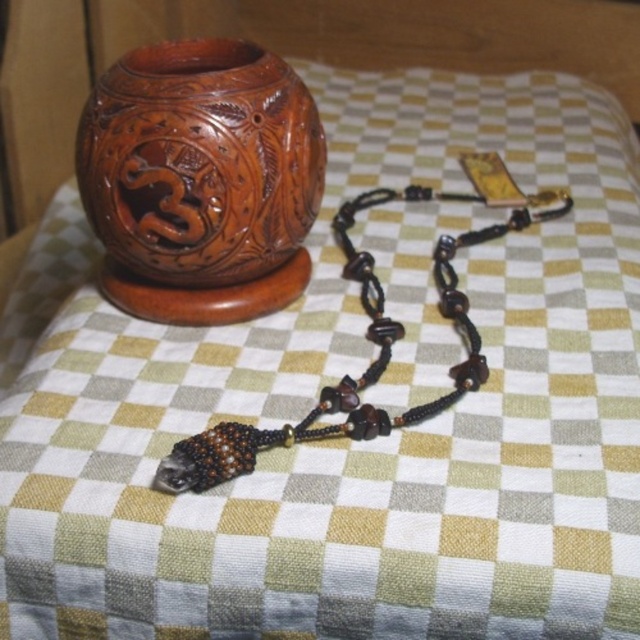
Describe the element at coordinates (200, 180) in the screenshot. I see `carved wood vase at upper left` at that location.

Is carved wood vase at upper left taller than brown beaded necklace at lower left?

In fact, carved wood vase at upper left may be shorter than brown beaded necklace at lower left.

From the picture: Who is more forward, (x=129, y=236) or (x=470, y=371)?

Point (x=470, y=371)

Identify the location of carved wood vase at upper left. This screenshot has width=640, height=640. (200, 180).